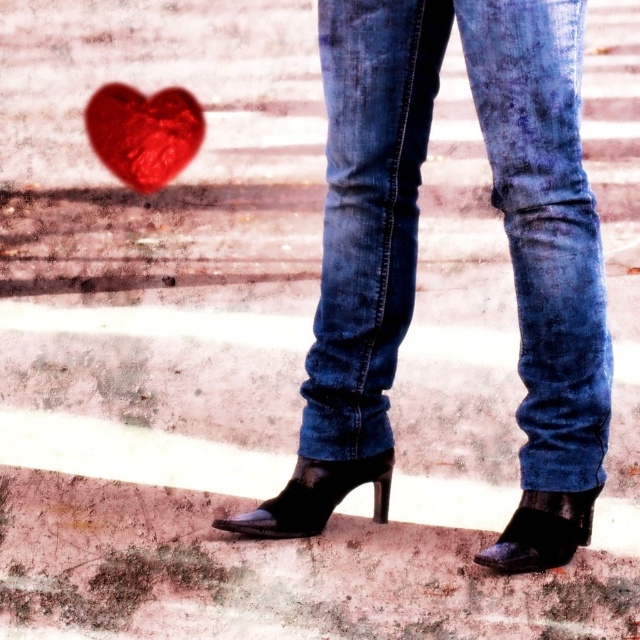
Where is `shiny red heart at upper left`? shiny red heart at upper left is located at coordinates (144, 132).

Who is positioned more to the right, shiny red heart at upper left or black leather boot at lower center?

Positioned to the right is black leather boot at lower center.

The height and width of the screenshot is (640, 640). I want to click on shiny red heart at upper left, so click(144, 132).

Is denim jeans at center thinner than black leather boot at lower right?

No, denim jeans at center is not thinner than black leather boot at lower right.

This screenshot has height=640, width=640. What do you see at coordinates (492, 204) in the screenshot?
I see `denim jeans at center` at bounding box center [492, 204].

Where is `denim jeans at center`? The image size is (640, 640). denim jeans at center is located at coordinates (492, 204).

Which is above, denim jeans at center or shiny red heart at upper left?

shiny red heart at upper left

Image resolution: width=640 pixels, height=640 pixels. I want to click on denim jeans at center, so click(492, 204).

Between point (381, 188) and point (124, 120), which one is positioned in front?

Point (381, 188)

Where is `denim jeans at center`? denim jeans at center is located at coordinates (492, 204).